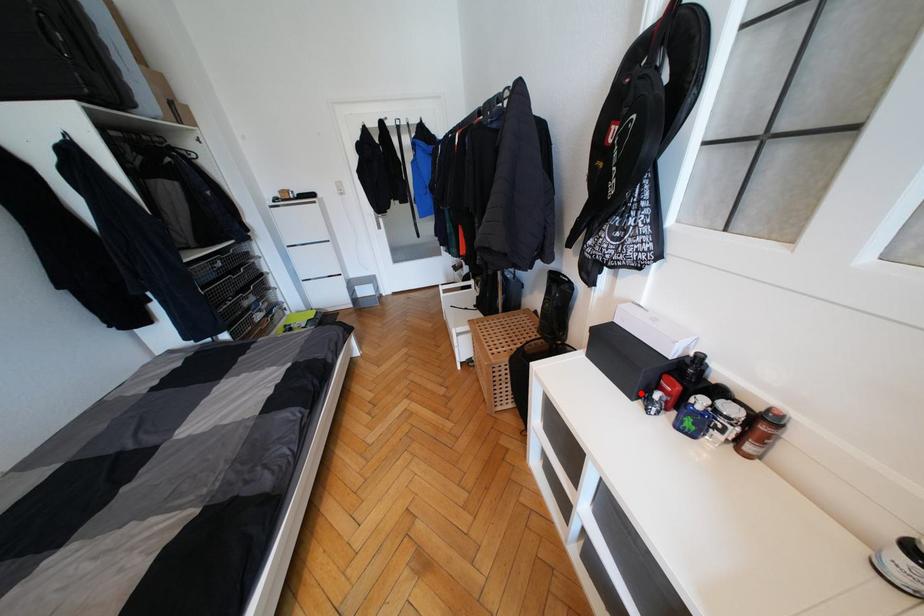
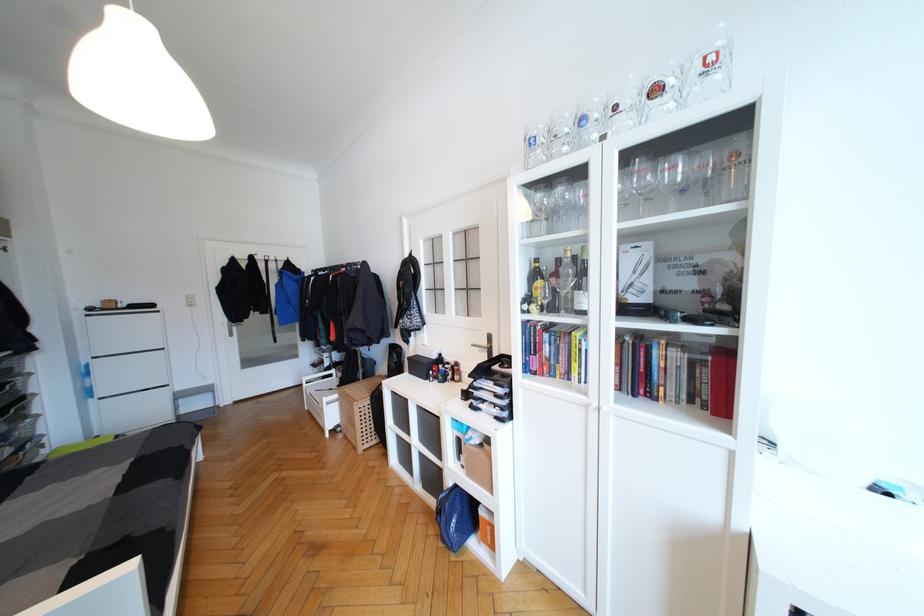
Question: A red point is marked in image1. In image2, is the corresponding 3D point closer to the camera or farther? Reply with the corresponding letter.

Choices:
 (A) The corresponding 3D point is closer.
 (B) The corresponding 3D point is farther.

Answer: (B)